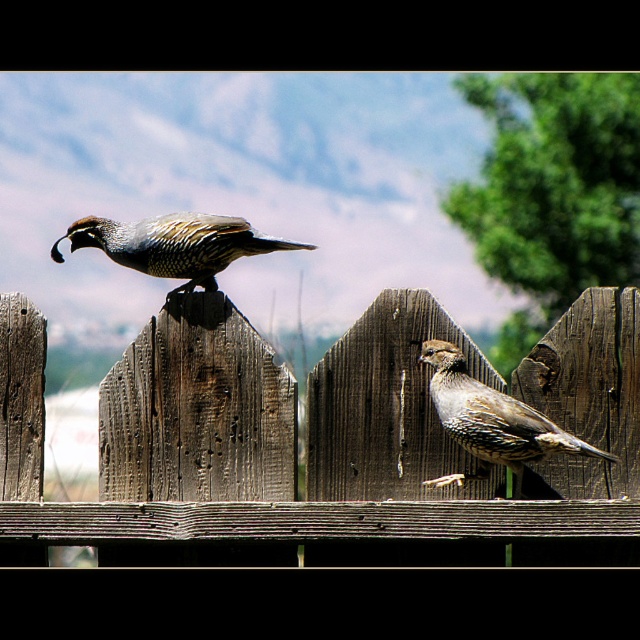
Who is taller, speckled feathered quail at center or shiny brown quail at center?

With more height is speckled feathered quail at center.

Is point (477, 387) farther from viewer compared to point (118, 246)?

No, it is in front of (118, 246).

At what (x,y) coordinates should I click in order to perform the action: click on speckled feathered quail at center. Please return your answer as a coordinate pair (x, y). The height and width of the screenshot is (640, 640). Looking at the image, I should click on (493, 417).

Between weathered wood fence at center and speckled feathered quail at center, which one has less height?

With less height is speckled feathered quail at center.

Which of these two, weathered wood fence at center or speckled feathered quail at center, stands taller?

With more height is weathered wood fence at center.

Does point (284, 429) come closer to viewer compared to point (444, 396)?

No, it is behind (444, 396).

Where is `weathered wood fence at center`? weathered wood fence at center is located at coordinates (356, 449).

Is point (227, 554) positioned before point (180, 276)?

Yes, point (227, 554) is in front of point (180, 276).

In order to click on weathered wood fence at center in this screenshot , I will do `click(356, 449)`.